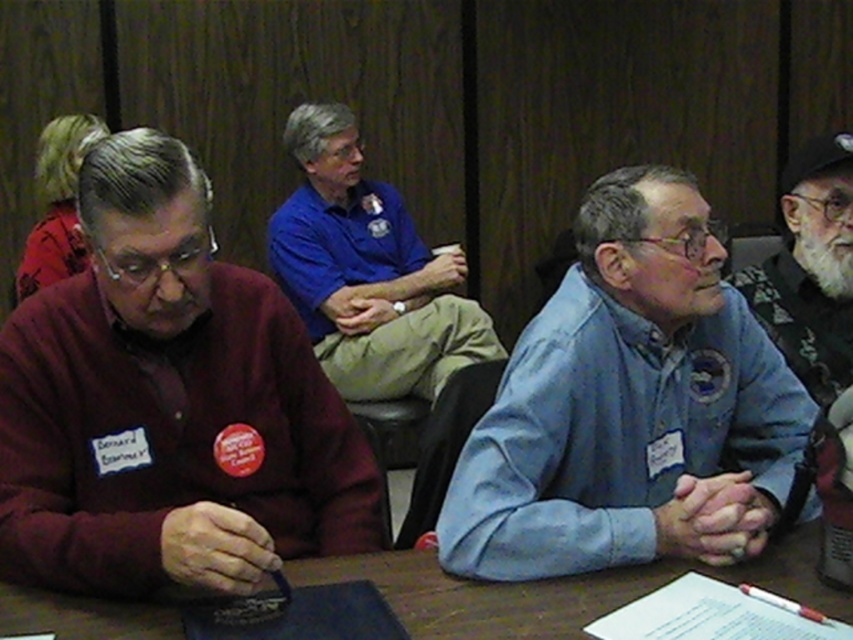
You are a person entering the conference room and see the point marked at coordinates (167, 404). What object is located at that point?

The maroon sweater at left is located at point (167, 404).

You are standing in the conference room and need to hand a document to the person wearing the maroon sweater at left. Based on their position, which direction should you approach from to reach them?

The maroon sweater at left is located at point (167, 404), so you should approach from the left side to reach them.